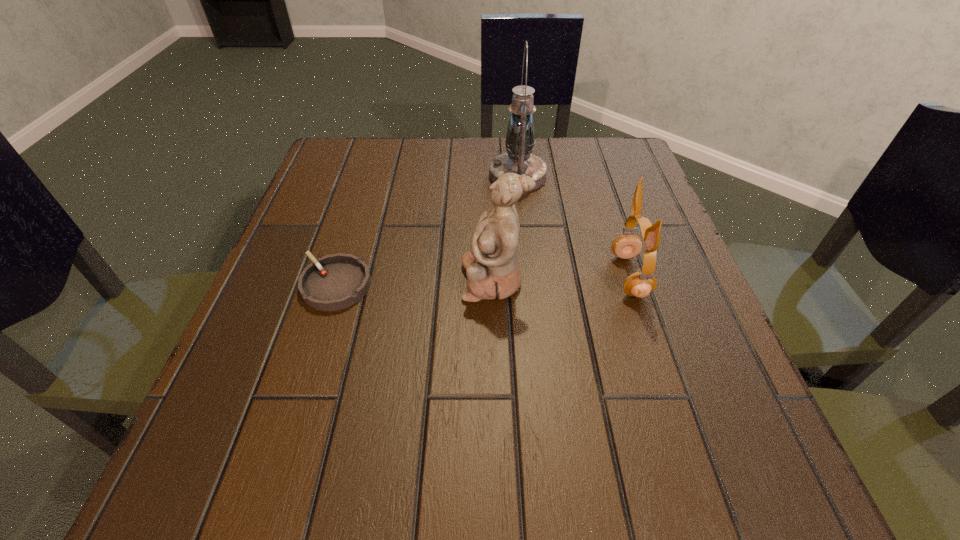
At what (x,y) coordinates should I click in order to perform the action: click on unoccupied position between the second tallest object and the leftmost object. Please return your answer as a coordinate pair (x, y). The height and width of the screenshot is (540, 960). Looking at the image, I should click on (415, 282).

Find the location of a particular element. This screenshot has width=960, height=540. free space between the ashtray and the tallest object is located at coordinates point(427,231).

This screenshot has width=960, height=540. Identify the location of free spot between the farthest object and the ashtray. (427, 231).

Where is `the second closest object to the figurine`? The image size is (960, 540). the second closest object to the figurine is located at coordinates (640, 284).

Where is `the second closest object relative to the figurine`? The image size is (960, 540). the second closest object relative to the figurine is located at coordinates (640, 284).

Where is `free location that satisfies the following two spatial constraints: 1. on the front side of the oil lamp; 2. on the front-facing side of the second tallest object`? free location that satisfies the following two spatial constraints: 1. on the front side of the oil lamp; 2. on the front-facing side of the second tallest object is located at coordinates (529, 280).